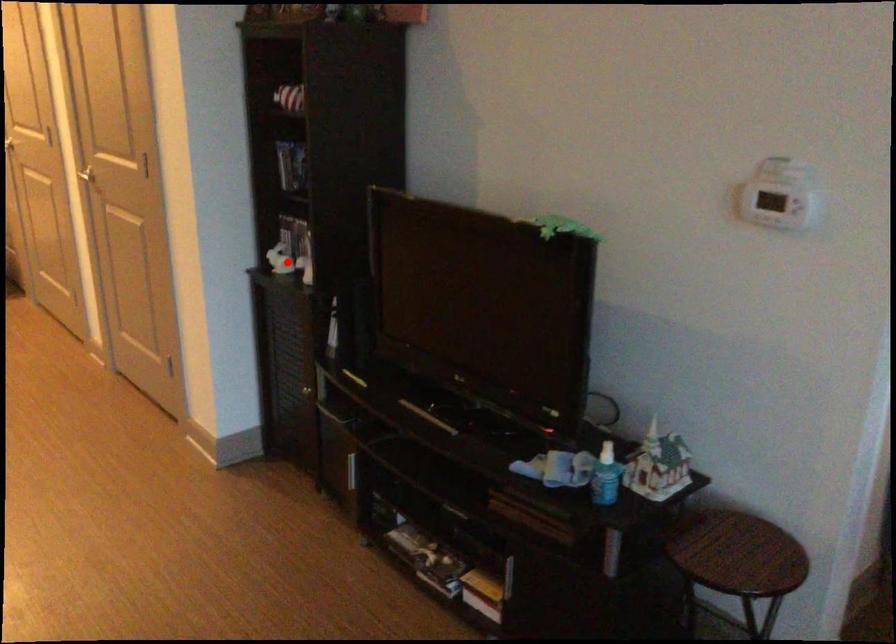
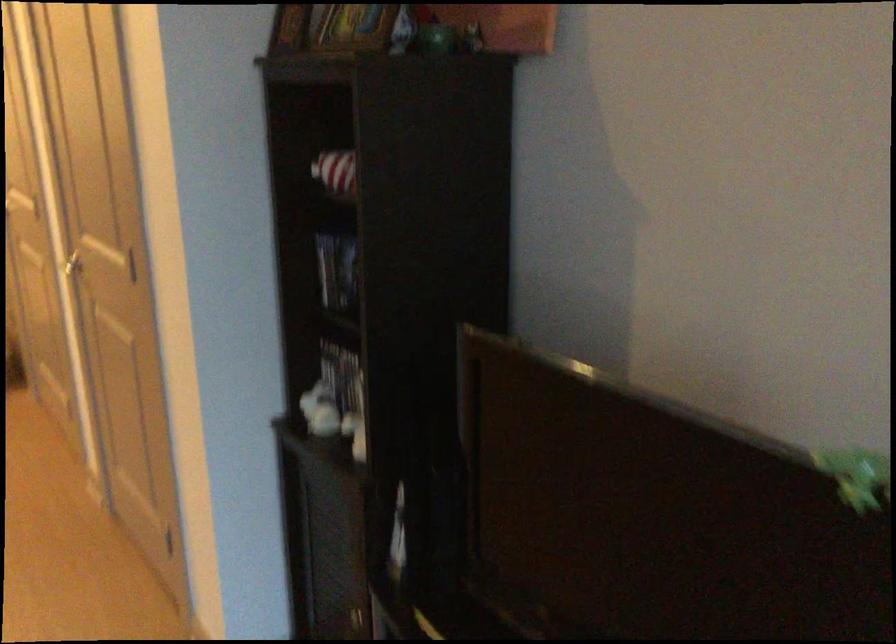
Question: I am providing you with two images of the same scene from different viewpoints. Given a red point in image1, look at the same physical point in image2. Is it:

Choices:
 (A) Closer to the viewpoint
 (B) Farther from the viewpoint

Answer: (A)